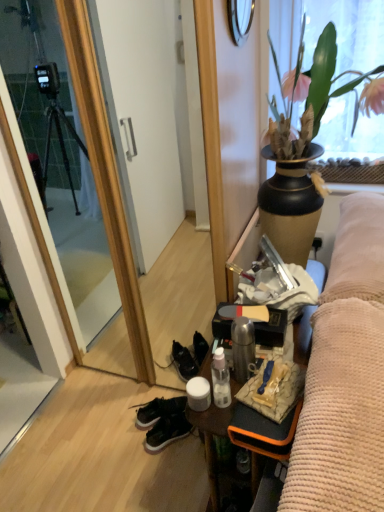
What are the coordinates of `metallic circular mirror at upper center` in the screenshot? It's located at (240, 19).

Measure the distance between black suede sneakers at lower center and camera.

They are 1.83 meters apart.

This screenshot has height=512, width=384. What do you see at coordinates (158, 410) in the screenshot?
I see `black leather sneakers at lower center` at bounding box center [158, 410].

This screenshot has height=512, width=384. Describe the element at coordinates (211, 441) in the screenshot. I see `metallic silver desk at center` at that location.

At what (x,y) coordinates should I click in order to perform the action: click on metallic circular mirror at upper center. Please return your answer as a coordinate pair (x, y). This screenshot has height=512, width=384. Looking at the image, I should click on (240, 19).

Does point (152, 439) lie behind point (139, 405)?

No, (152, 439) is closer to viewer.

Which of these two, black suede sneakers at lower center or black leather sneakers at lower center, is smaller?

Smaller between the two is black suede sneakers at lower center.

Considering the positions of objects black suede sneakers at lower center and black leather sneakers at lower center in the image provided, who is more to the right, black suede sneakers at lower center or black leather sneakers at lower center?

black suede sneakers at lower center is more to the right.

Is metallic silver desk at center outside of black suede sneakers at lower center?

Yes, metallic silver desk at center is outside of black suede sneakers at lower center.

In the scene shown: Is metallic silver desk at center positioned far away from black suede sneakers at lower center?

No, there isn't a large distance between metallic silver desk at center and black suede sneakers at lower center.

Considering their positions, is black leather sneakers at lower center located in front of or behind matte black vase with plant at upper right?

Visually, black leather sneakers at lower center is located behind matte black vase with plant at upper right.

Considering the relative sizes of black leather sneakers at lower center and matte black vase with plant at upper right in the image provided, is black leather sneakers at lower center bigger than matte black vase with plant at upper right?

No.

How much distance is there between black leather sneakers at lower center and matte black vase with plant at upper right?

black leather sneakers at lower center and matte black vase with plant at upper right are 3.90 feet apart.

Choose the correct answer: Is metallic silver desk at center inside metallic circular mirror at upper center or outside it?

metallic silver desk at center lies outside metallic circular mirror at upper center.

Where is `desk lying on the right of metallic circular mirror at upper center`? desk lying on the right of metallic circular mirror at upper center is located at coordinates (211, 441).

Between point (210, 502) and point (235, 18), which one is positioned behind?

The point (210, 502) is farther.

Is metallic silver desk at center not close to metallic circular mirror at upper center?

→ Yes, metallic silver desk at center is far from metallic circular mirror at upper center.

Locate an element on the screen. This screenshot has width=384, height=512. sneakers directly beneath the metallic circular mirror at upper center (from a real-world perspective) is located at coordinates (167, 431).

Is black suede sneakers at lower center directly adjacent to metallic circular mirror at upper center?

They are not placed beside each other.

Is point (167, 421) closer to viewer compared to point (241, 18)?

No, (167, 421) is behind (241, 18).

Which is more to the left, black suede sneakers at lower center or metallic circular mirror at upper center?

black suede sneakers at lower center is more to the left.

Does metallic silver desk at center come behind matte black vase with plant at upper right?

Yes.

Considering the sizes of metallic silver desk at center and matte black vase with plant at upper right in the image, is metallic silver desk at center bigger or smaller than matte black vase with plant at upper right?

metallic silver desk at center is bigger than matte black vase with plant at upper right.

Is matte black vase with plant at upper right at the back of metallic silver desk at center?

metallic silver desk at center is not turned away from matte black vase with plant at upper right.

Does metallic circular mirror at upper center have a greater width compared to black suede sneakers at lower center?

No.

How many degrees apart are the facing directions of metallic circular mirror at upper center and black suede sneakers at lower center?

They differ by 51.2 degrees in their facing directions.

Is metallic circular mirror at upper center looking in the opposite direction of black suede sneakers at lower center?

No, metallic circular mirror at upper center is not facing the opposite direction of black suede sneakers at lower center.

Can black suede sneakers at lower center be found inside metallic circular mirror at upper center?

No, black suede sneakers at lower center is not surrounded by metallic circular mirror at upper center.

Where is `footwear lying above the black suede sneakers at lower center (from the image's perspective)`? footwear lying above the black suede sneakers at lower center (from the image's perspective) is located at coordinates (158, 410).

Locate an element on the screen. The height and width of the screenshot is (512, 384). sneakers below the metallic silver desk at center (from a real-world perspective) is located at coordinates (167, 431).

Considering their positions, is matte black vase with plant at upper right positioned closer to metallic silver desk at center than metallic circular mirror at upper center?

matte black vase with plant at upper right is closer to metallic silver desk at center.

From the image, which object appears to be farther from matte black vase with plant at upper right, metallic circular mirror at upper center or metallic silver desk at center?

The object further to matte black vase with plant at upper right is metallic silver desk at center.

From the image, which object appears to be nearer to metallic silver desk at center, matte black vase with plant at upper right or black suede sneakers at lower center?

black suede sneakers at lower center.

When comparing their distances from matte black vase with plant at upper right, does metallic silver desk at center or black leather sneakers at lower center seem closer?

metallic silver desk at center.

Based on their spatial positions, is black leather sneakers at lower center or black suede sneakers at lower center further from metallic silver desk at center?

black leather sneakers at lower center is positioned further to the anchor metallic silver desk at center.

Estimate the real-world distances between objects in this image. Which object is further from metallic circular mirror at upper center, black leather sneakers at lower center or matte black vase with plant at upper right?

black leather sneakers at lower center is positioned further to the anchor metallic circular mirror at upper center.

Based on their spatial positions, is metallic silver desk at center or metallic circular mirror at upper center closer to black suede sneakers at lower center?

Based on the image, metallic silver desk at center appears to be nearer to black suede sneakers at lower center.

From the image, which object appears to be nearer to black suede sneakers at lower center, metallic circular mirror at upper center or black leather sneakers at lower center?

The object closer to black suede sneakers at lower center is black leather sneakers at lower center.

Locate an element on the screen. sneakers between metallic silver desk at center and black leather sneakers at lower center in the front-back direction is located at coordinates (167, 431).

The height and width of the screenshot is (512, 384). What are the coordinates of `houseplant between metallic circular mirror at upper center and metallic silver desk at center from top to bottom` in the screenshot? It's located at (319, 79).

At what (x,y) coordinates should I click in order to perform the action: click on desk between metallic circular mirror at upper center and black suede sneakers at lower center in the vertical direction. Please return your answer as a coordinate pair (x, y). This screenshot has height=512, width=384. Looking at the image, I should click on (211, 441).

This screenshot has width=384, height=512. Find the location of `footwear between matte black vase with plant at upper right and black suede sneakers at lower center from top to bottom`. footwear between matte black vase with plant at upper right and black suede sneakers at lower center from top to bottom is located at coordinates (158, 410).